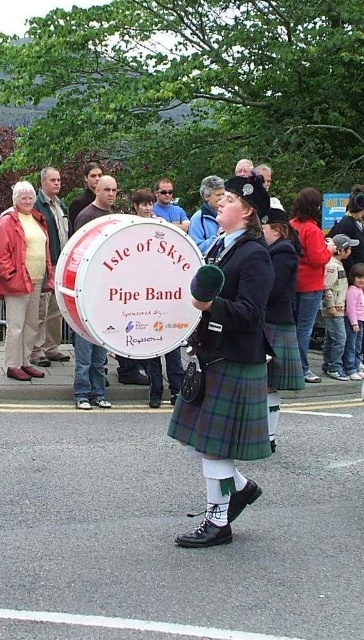
Question: From the image, what is the correct spatial relationship of plaid fabric kilt at center in relation to matte white drum at left?

Choices:
 (A) right
 (B) left

Answer: (A)

Question: Is matte white drum at center to the left of matte white drum at left from the viewer's perspective?

Choices:
 (A) yes
 (B) no

Answer: (B)

Question: Among these objects, which one is farthest from the camera?

Choices:
 (A) matte white drum at center
 (B) plaid fabric kilt at center
 (C) gray hair at upper center

Answer: (C)

Question: Is the position of matte white drum at center more distant than that of matte white drum at left?

Choices:
 (A) no
 (B) yes

Answer: (A)

Question: Which object is positioned closest to the matte white drum at left?

Choices:
 (A) plaid fabric kilt at center
 (B) matte black drum at upper center

Answer: (B)

Question: Based on their relative distances, which object is nearer to the matte white drum at left?

Choices:
 (A) gray hair at upper center
 (B) plaid fabric kilt at center
 (C) matte green jacket at upper left
 (D) matte white drum at center

Answer: (D)